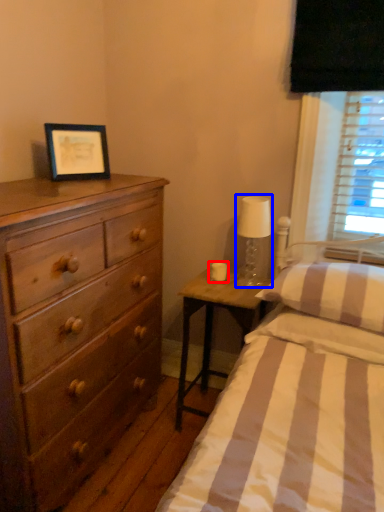
Question: Among these objects, which one is nearest to the camera, candle holder (highlighted by a red box) or bedside lamp (highlighted by a blue box)?

Choices:
 (A) candle holder
 (B) bedside lamp

Answer: (B)